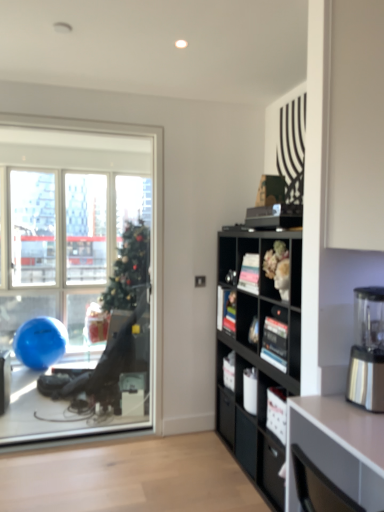
Question: Is matte black bookshelf at center wider or thinner than white glossy desk at lower right?

Choices:
 (A) wide
 (B) thin

Answer: (B)

Question: From a real-world perspective, relative to white glossy desk at lower right, is matte black bookshelf at center vertically above or below?

Choices:
 (A) above
 (B) below

Answer: (A)

Question: Which is farther from the black matte bookshelf at center-right?

Choices:
 (A) transparent glass window at left
 (B) white glossy desk at lower right
 (C) stainless steel blender at right
 (D) matte black bookshelf at center

Answer: (A)

Question: Which is farther from the matte black bookshelf at center?

Choices:
 (A) black matte bookshelf at center-right
 (B) white glossy desk at lower right
 (C) stainless steel blender at right
 (D) transparent glass window at left

Answer: (D)